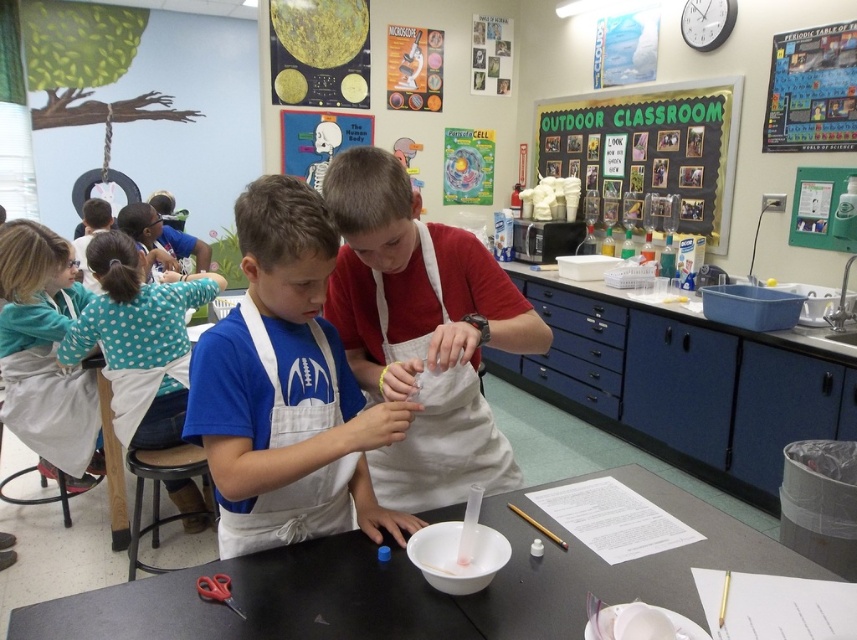
Who is more distant from viewer, (657, 477) or (583, 93)?

The point (583, 93) is behind.

Measure the distance between black matte table at center and green chalkboard at upper center.

The distance of black matte table at center from green chalkboard at upper center is 10.05 feet.

Between point (565, 618) and point (733, 148), which one is positioned behind?

Positioned behind is point (733, 148).

The width and height of the screenshot is (857, 640). What are the coordinates of `black matte table at center` in the screenshot? It's located at (417, 586).

Does blue fabric shirt at center lie in front of teal polka dot shirt at upper left?

Yes, blue fabric shirt at center is closer to the viewer.

Can you confirm if blue fabric shirt at center is smaller than teal polka dot shirt at upper left?

Yes.

Locate an element on the screen. Image resolution: width=857 pixels, height=640 pixels. blue fabric shirt at center is located at coordinates (286, 388).

Where is `blue fabric shirt at center`? This screenshot has height=640, width=857. blue fabric shirt at center is located at coordinates (286, 388).

Between point (150, 419) and point (649, 90), which one is positioned behind?

The point (649, 90) is behind.

Does teal polka dot shirt at upper left have a greater height compared to green chalkboard at upper center?

Incorrect, teal polka dot shirt at upper left's height is not larger of green chalkboard at upper center's.

Describe the element at coordinates (139, 339) in the screenshot. The height and width of the screenshot is (640, 857). I see `teal polka dot shirt at upper left` at that location.

This screenshot has height=640, width=857. Identify the location of teal polka dot shirt at upper left. (139, 339).